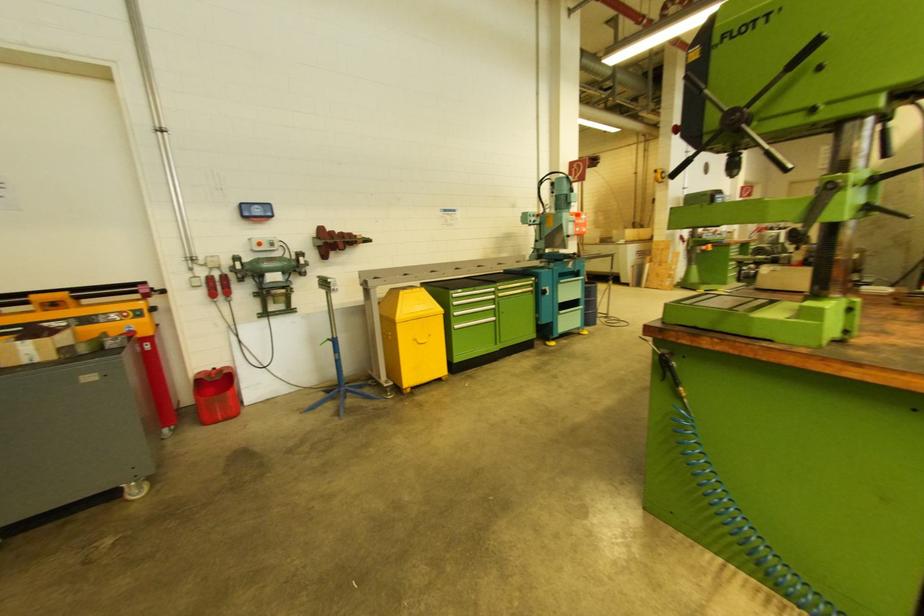
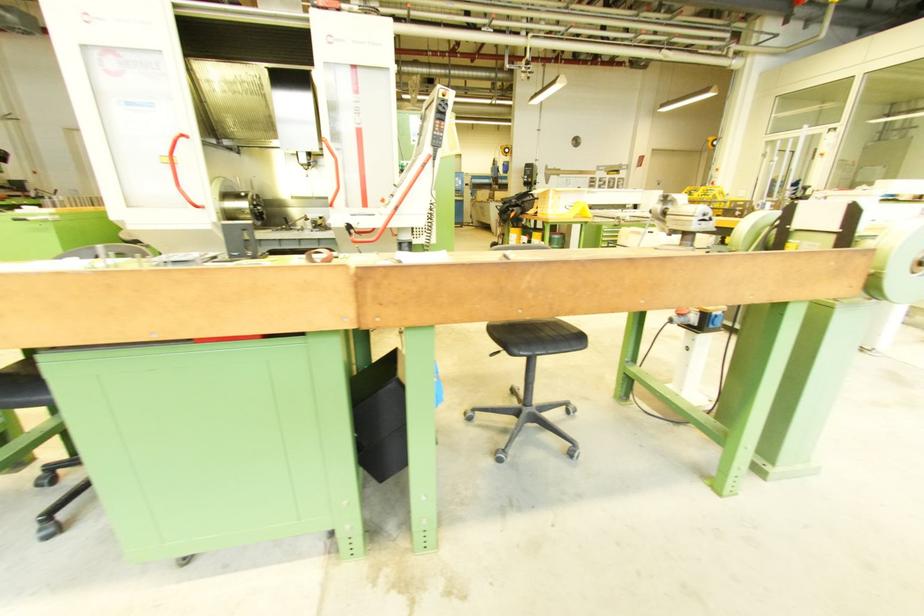
Question: I am providing you with two images of the same scene from different viewpoints. Which of the following objects are not visible in image2?

Choices:
 (A) black chair sitting surface
 (B) plastic laundry basket
 (C) machine control pendant
 (D) red electrical plug

Answer: (D)